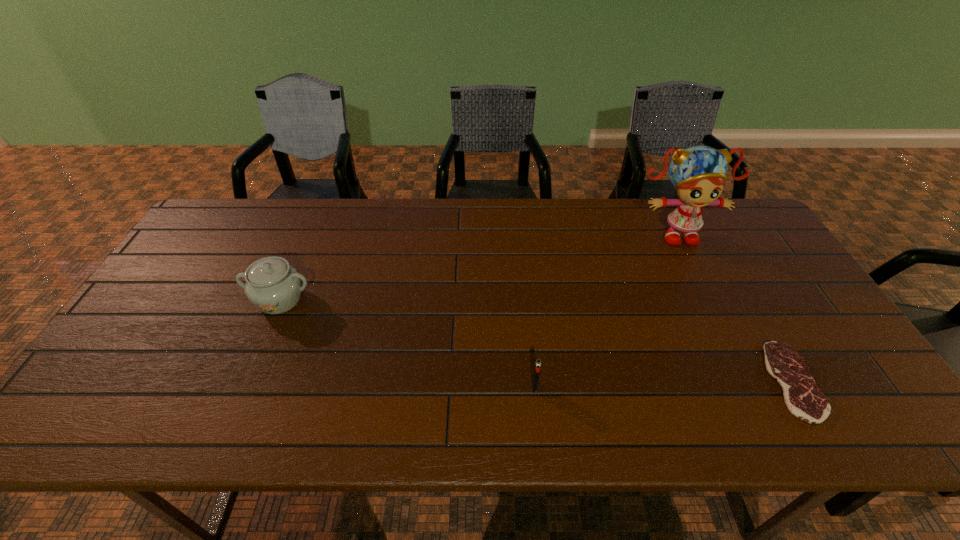
This screenshot has height=540, width=960. I want to click on vacant space situated on the back of the steak, so click(733, 279).

Locate an element on the screen. Image resolution: width=960 pixels, height=540 pixels. object at the far edge is located at coordinates (698, 173).

The width and height of the screenshot is (960, 540). Find the location of `object at the near edge`. object at the near edge is located at coordinates (804, 399).

Find the location of a particular element. The image size is (960, 540). doll located at the right edge is located at coordinates tap(698, 173).

This screenshot has width=960, height=540. In order to click on steak that is positioned at the right edge in this screenshot , I will do `click(804, 399)`.

The height and width of the screenshot is (540, 960). I want to click on object located in the far right corner section of the desktop, so click(698, 173).

What are the coordinates of `object that is positioned at the near right corner` in the screenshot? It's located at (804, 399).

This screenshot has height=540, width=960. Identify the location of free region at the far edge of the desktop. pos(618,228).

You are a GUI agent. You are given a task and a screenshot of the screen. Output one action in this format:
    pyautogui.click(x=<x>, y=<y>)
    Task: Click on the blank space at the near edge
    
    Given the screenshot: What is the action you would take?
    pyautogui.click(x=219, y=404)

At what (x,y) coordinates should I click in order to perform the action: click on vacant space at the left edge. Please return your answer as a coordinate pair (x, y). This screenshot has height=540, width=960. Looking at the image, I should click on (179, 269).